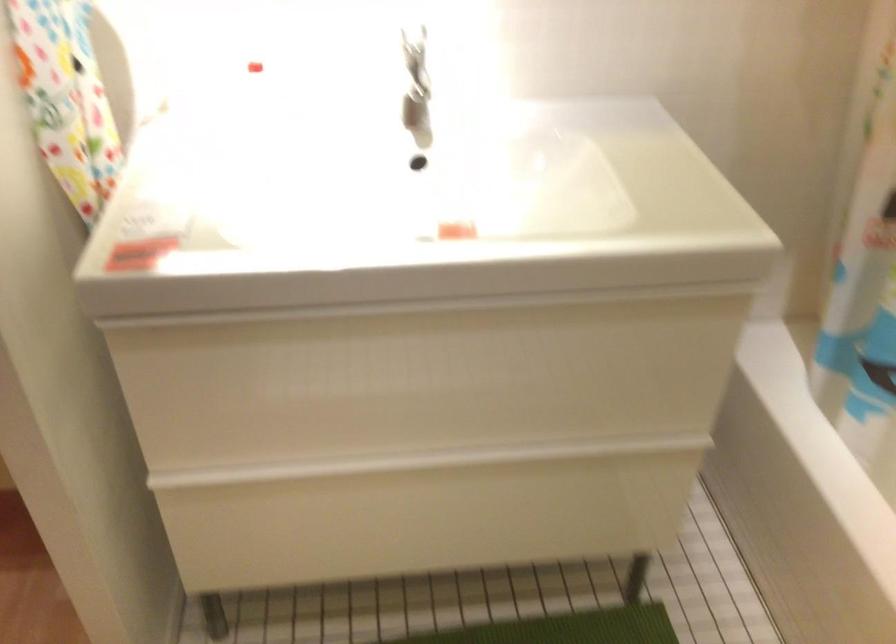
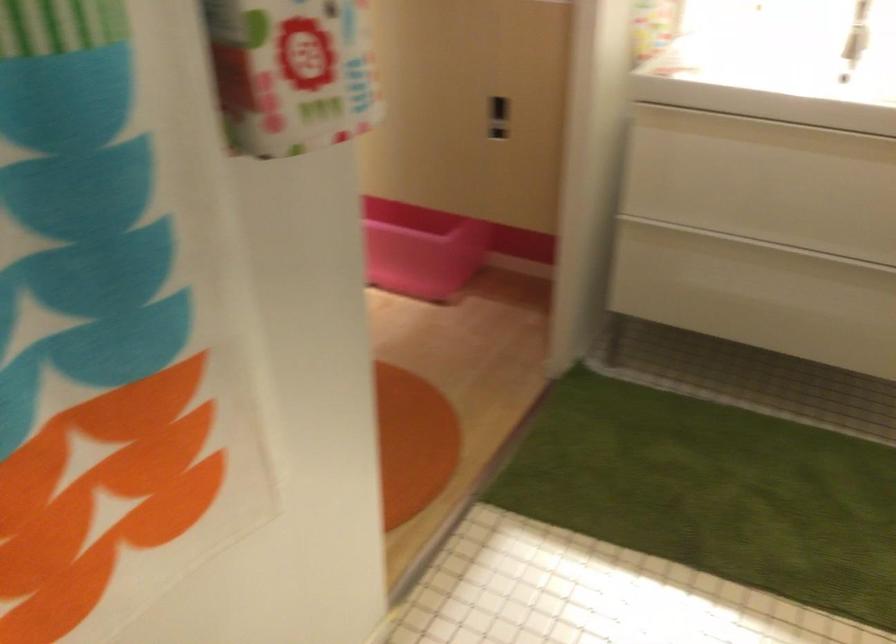
In the second image, find the point that corresponds to [350,489] in the first image.

(734, 254)